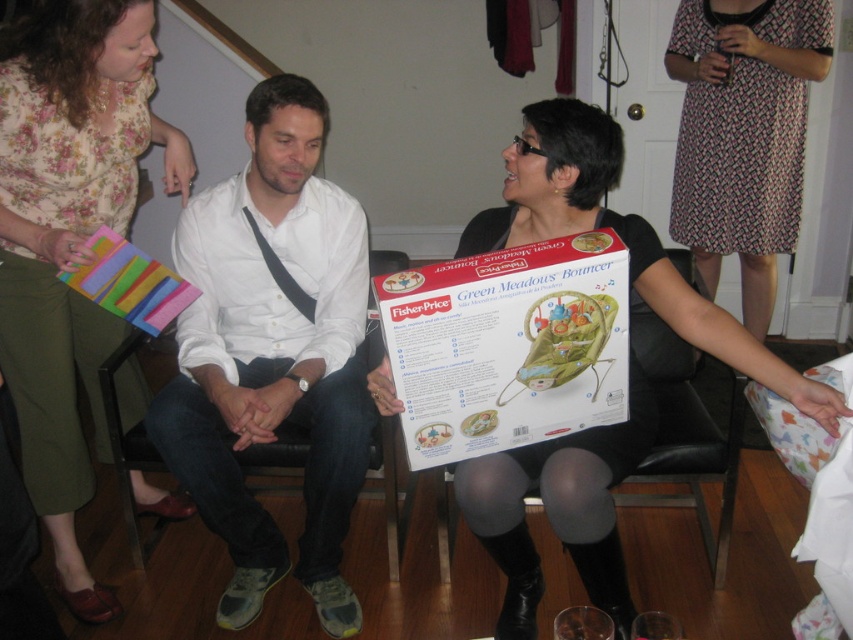
Between point (96, 365) and point (611, 467), which one is positioned in front?

Positioned in front is point (611, 467).

Can you confirm if floral fabric blouse at upper left is positioned above matte black bouncer at center?

Yes.

Is point (102, 604) closer to viewer compared to point (782, 365)?

No, it is behind (782, 365).

Identify the location of floral fabric blouse at upper left. This screenshot has height=640, width=853. (68, 236).

Who is positioned more to the left, white matte shirt at center or floral fabric blouse at upper left?

floral fabric blouse at upper left is more to the left.

Does white matte shirt at center appear over floral fabric blouse at upper left?

Incorrect, white matte shirt at center is not positioned above floral fabric blouse at upper left.

The width and height of the screenshot is (853, 640). I want to click on white matte shirt at center, so click(x=271, y=353).

Who is taller, white cardboard box at center or black leather armchair at center?

black leather armchair at center

Is point (416, 356) in front of point (718, 461)?

Yes, point (416, 356) is closer to viewer.

You are a GUI agent. You are given a task and a screenshot of the screen. Output one action in this format:
    pyautogui.click(x=<x>, y=<y>)
    Task: Click on the white cardboard box at center
    This screenshot has height=640, width=853.
    Given the screenshot: What is the action you would take?
    pyautogui.click(x=508, y=346)